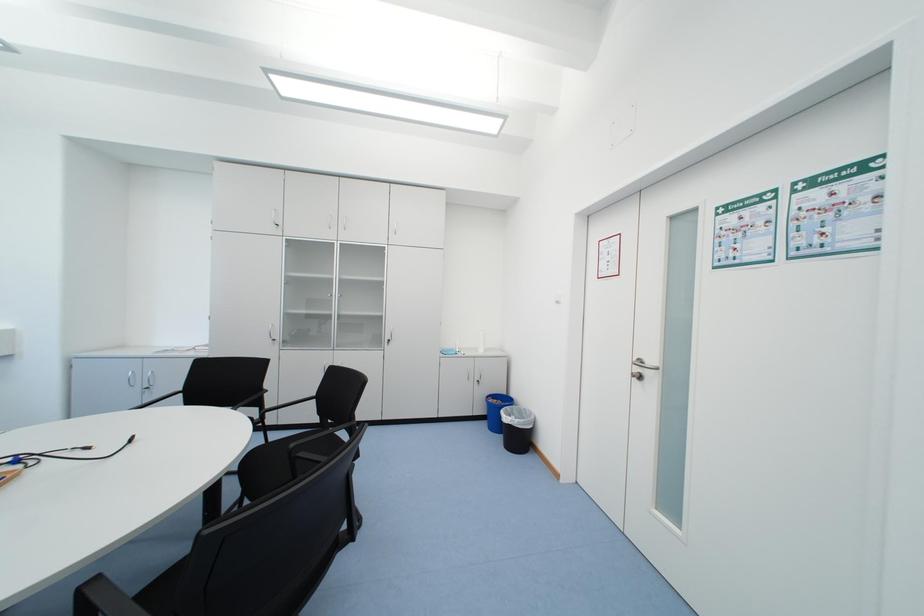
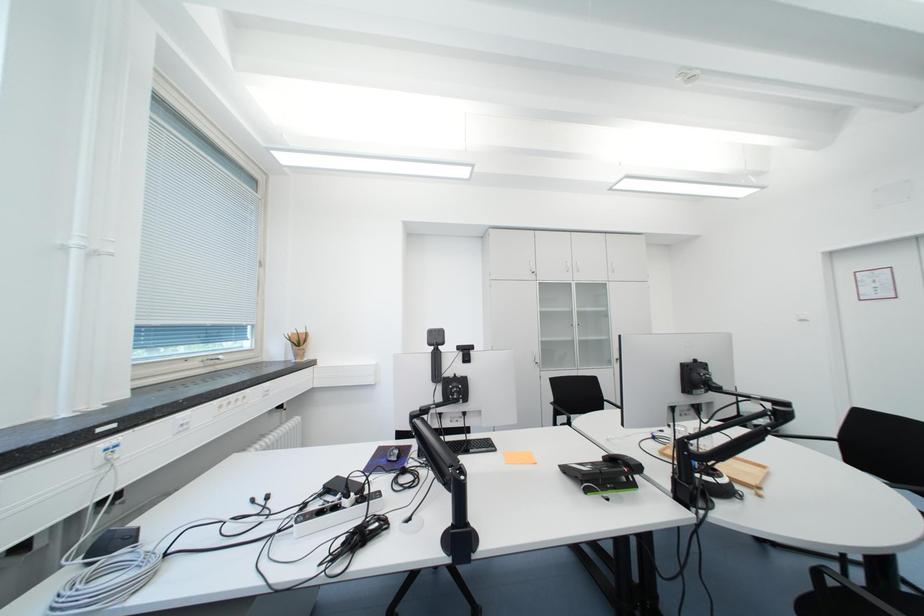
Question: Which direction would the cameraman need to move to produce the second image? Reply with the corresponding letter.

Choices:
 (A) Left
 (B) Right
 (C) Forward
 (D) Backward

Answer: (A)